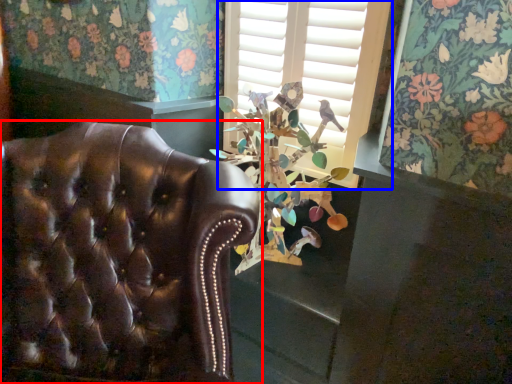
Question: Which point is closer to the camera, chair (highlighted by a red box) or window (highlighted by a blue box)?

Choices:
 (A) chair
 (B) window

Answer: (A)